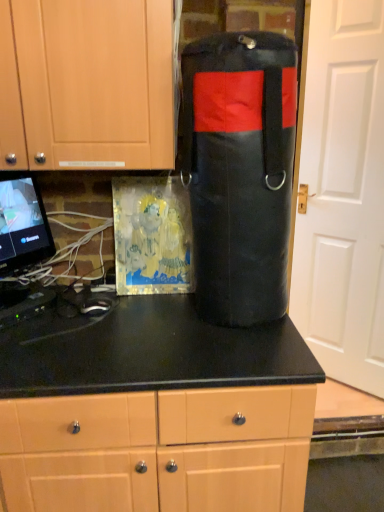
The height and width of the screenshot is (512, 384). What do you see at coordinates (240, 170) in the screenshot?
I see `black leather punching bag at center` at bounding box center [240, 170].

How much space does matte wood cabinet at upper left, which ranks as the 1th cabinetry in top-to-bottom order, occupy horizontally?

The width of matte wood cabinet at upper left, which ranks as the 1th cabinetry in top-to-bottom order, is 15.27 inches.

You are a GUI agent. You are given a task and a screenshot of the screen. Output one action in this format:
    pyautogui.click(x=<x>, y=<y>)
    Task: Click on the matte black monitor at left
    
    Given the screenshot: What is the action you would take?
    pyautogui.click(x=22, y=223)

The image size is (384, 512). What do you see at coordinates (22, 223) in the screenshot? I see `matte black monitor at left` at bounding box center [22, 223].

Image resolution: width=384 pixels, height=512 pixels. What do you see at coordinates (159, 450) in the screenshot?
I see `matte black countertop at center, acting as the second cabinetry starting from the top` at bounding box center [159, 450].

What is the approximate width of black plastic router at lower left?

It is 20.34 centimeters.

What are the coordinates of `black leather punching bag at center` in the screenshot? It's located at (240, 170).

From the image's perspective, is black plastic router at lower left above matte black monitor at left?

No.

Which is more to the right, black plastic router at lower left or matte black monitor at left?

matte black monitor at left is more to the right.

Between black plastic router at lower left and matte black monitor at left, which one has larger width?

With larger width is black plastic router at lower left.

Is point (178, 450) closer to camera compared to point (29, 200)?

Yes, point (178, 450) is in front of point (29, 200).

Does matte black countertop at center, acting as the second cabinetry starting from the top, have a greater height compared to matte black monitor at left?

Yes.

Considering the relative sizes of matte black countertop at center, acting as the second cabinetry starting from the top, and matte black monitor at left in the image provided, is matte black countertop at center, acting as the second cabinetry starting from the top, smaller than matte black monitor at left?

No, matte black countertop at center, acting as the second cabinetry starting from the top, is not smaller than matte black monitor at left.

Is matte black countertop at center, the first cabinetry positioned from the bottom, inside the boundaries of matte black monitor at left, or outside?

matte black countertop at center, the first cabinetry positioned from the bottom, lies outside matte black monitor at left.

Which is closer to the camera, (375, 118) or (138, 506)?

The point (138, 506) is in front.

Would you say white matte door at right contains matte black countertop at center, acting as the second cabinetry starting from the top?

Actually, matte black countertop at center, acting as the second cabinetry starting from the top, is outside white matte door at right.

Is white matte door at right to the left or to the right of matte black countertop at center, the first cabinetry positioned from the bottom, in the image?

Clearly, white matte door at right is on the right of matte black countertop at center, the first cabinetry positioned from the bottom, in the image.

How far apart are matte wood cabinet at upper left, which ranks as the 1th cabinetry in top-to-bottom order, and black leather punching bag at center?

10.35 inches.

Is matte wood cabinet at upper left, acting as the 2th cabinetry starting from the bottom, bigger than black leather punching bag at center?

Yes, matte wood cabinet at upper left, acting as the 2th cabinetry starting from the bottom, is bigger than black leather punching bag at center.

Can you confirm if matte wood cabinet at upper left, which ranks as the 1th cabinetry in top-to-bottom order, is taller than black leather punching bag at center?

No.

From the image's perspective, is matte wood cabinet at upper left, which ranks as the 1th cabinetry in top-to-bottom order, over black leather punching bag at center?

Yes.

From the picture: Can you confirm if black leather punching bag at center is thinner than white matte door at right?

No.

Is black leather punching bag at center further to camera compared to white matte door at right?

No, it is in front of white matte door at right.

Does black leather punching bag at center touch white matte door at right?

They are not placed beside each other.

Does white matte door at right have a greater height compared to matte black monitor at left?

Yes, white matte door at right is taller than matte black monitor at left.

From the image's perspective, which is above, white matte door at right or matte black monitor at left?

From the image's view, white matte door at right is above.

How different are the orientations of white matte door at right and matte black monitor at left in degrees?

The angle between the facing direction of white matte door at right and the facing direction of matte black monitor at left is 98 degrees.

Looking at this image, do you think white matte door at right is within black leather punching bag at center, or outside of it?

white matte door at right is outside black leather punching bag at center.

Based on the photo, which is farther, (383,173) or (223,136)?

The point (383,173) is farther from the camera.

The width and height of the screenshot is (384, 512). Identify the location of door above the black leather punching bag at center (from the image's perspective). (343, 195).

Identify the location of computer monitor above the black plastic router at lower left (from the image's perspective). pyautogui.click(x=22, y=223).

Find the location of a particular element. Image resolution: width=384 pixels, height=512 pixels. computer monitor positioned vertically above the matte black countertop at center, acting as the second cabinetry starting from the top (from a real-world perspective) is located at coordinates (22, 223).

From the image, which object appears to be nearer to white matte door at right, black leather punching bag at center or matte wood cabinet at upper left, acting as the 2th cabinetry starting from the bottom?

The object closer to white matte door at right is black leather punching bag at center.

Considering their positions, is white matte door at right positioned closer to black plastic router at lower left than matte wood cabinet at upper left, which ranks as the 1th cabinetry in top-to-bottom order?

Based on the image, matte wood cabinet at upper left, which ranks as the 1th cabinetry in top-to-bottom order, appears to be nearer to black plastic router at lower left.

In the scene shown: Estimate the real-world distances between objects in this image. Which object is closer to black leather punching bag at center, black plastic router at lower left or white matte door at right?

black plastic router at lower left is positioned closer to the anchor black leather punching bag at center.

Based on their spatial positions, is matte black countertop at center, the first cabinetry positioned from the bottom, or white matte door at right further from matte black monitor at left?

white matte door at right is positioned further to the anchor matte black monitor at left.

Which object lies further to the anchor point matte black countertop at center, the first cabinetry positioned from the bottom, matte wood cabinet at upper left, which ranks as the 1th cabinetry in top-to-bottom order, or matte black monitor at left?

The object further to matte black countertop at center, the first cabinetry positioned from the bottom, is matte wood cabinet at upper left, which ranks as the 1th cabinetry in top-to-bottom order.

Estimate the real-world distances between objects in this image. Which object is further from white matte door at right, matte black monitor at left or matte wood cabinet at upper left, acting as the 2th cabinetry starting from the bottom?

matte black monitor at left is positioned further to the anchor white matte door at right.

Which object lies nearer to the anchor point matte wood cabinet at upper left, which ranks as the 1th cabinetry in top-to-bottom order, matte black monitor at left or black leather punching bag at center?

Among the two, black leather punching bag at center is located nearer to matte wood cabinet at upper left, which ranks as the 1th cabinetry in top-to-bottom order.

Based on the photo, based on their spatial positions, is black leather punching bag at center or matte black countertop at center, acting as the second cabinetry starting from the top, closer to matte wood cabinet at upper left, acting as the 2th cabinetry starting from the bottom?

The object closer to matte wood cabinet at upper left, acting as the 2th cabinetry starting from the bottom, is black leather punching bag at center.

Identify the location of computer monitor situated between black plastic router at lower left and black leather punching bag at center from left to right. (22, 223).

This screenshot has height=512, width=384. I want to click on appliance between matte black monitor at left and matte black countertop at center, the first cabinetry positioned from the bottom, in the vertical direction, so click(24, 303).

Identify the location of appliance between black leather punching bag at center and matte black countertop at center, the first cabinetry positioned from the bottom, in the vertical direction. (24, 303).

Find the location of a particular element. appliance between matte wood cabinet at upper left, which ranks as the 1th cabinetry in top-to-bottom order, and matte black countertop at center, acting as the second cabinetry starting from the top, from top to bottom is located at coordinates (24, 303).